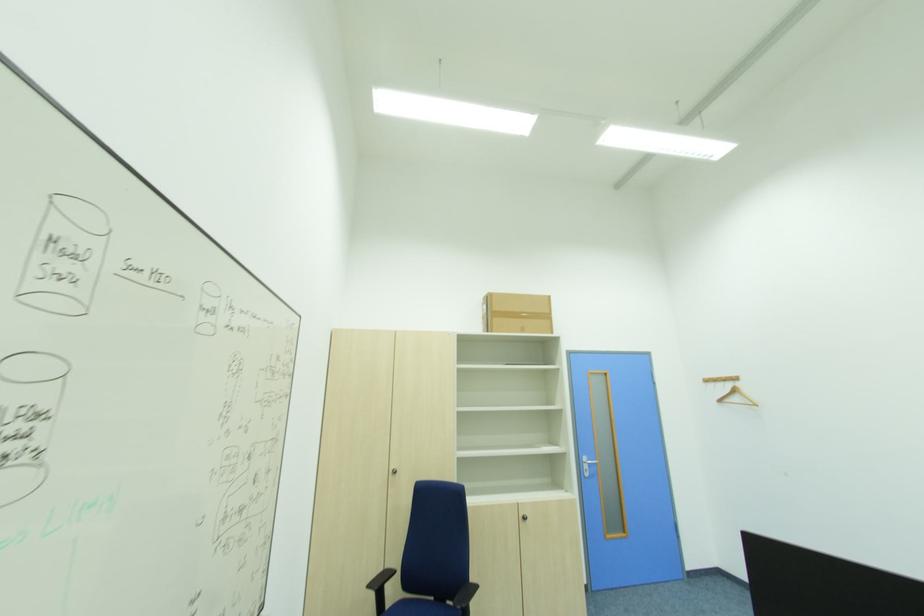
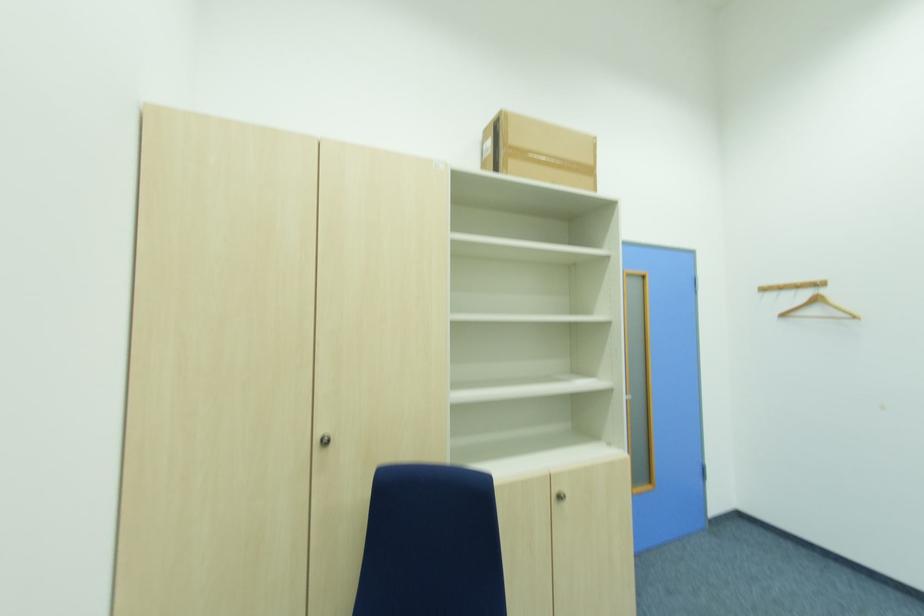
In the second image, find the point that corresponds to [733,387] in the first image.

(809, 296)